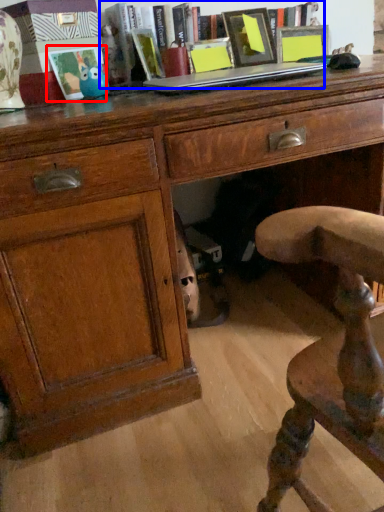
Question: Which object is closer to the camera taking this photo, picture frame (highlighted by a red box) or book (highlighted by a blue box)?

Choices:
 (A) picture frame
 (B) book

Answer: (A)